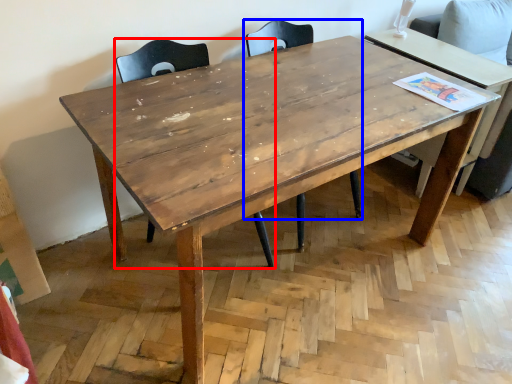
Question: Which object appears closest to the camera in this image, chair (highlighted by a red box) or chair (highlighted by a blue box)?

Choices:
 (A) chair
 (B) chair

Answer: (A)